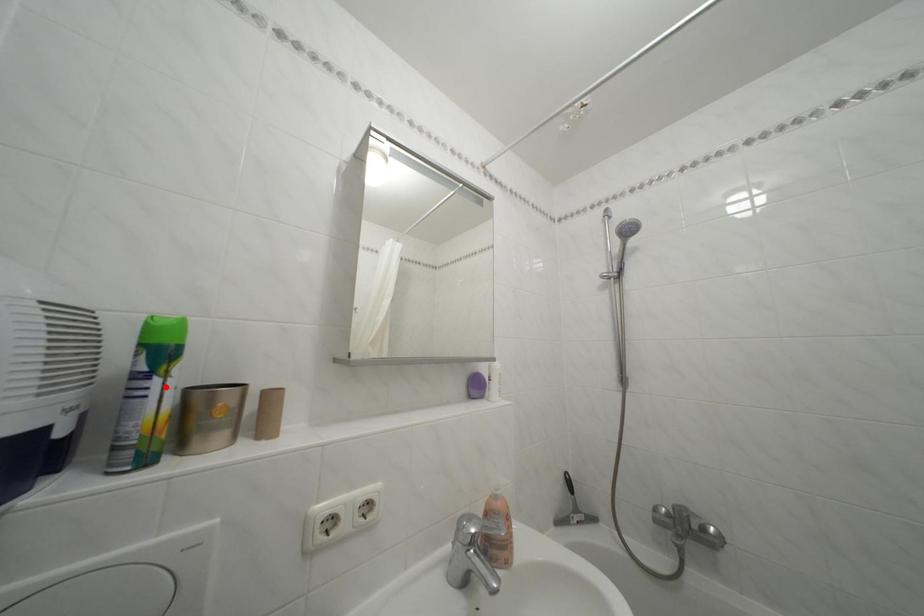
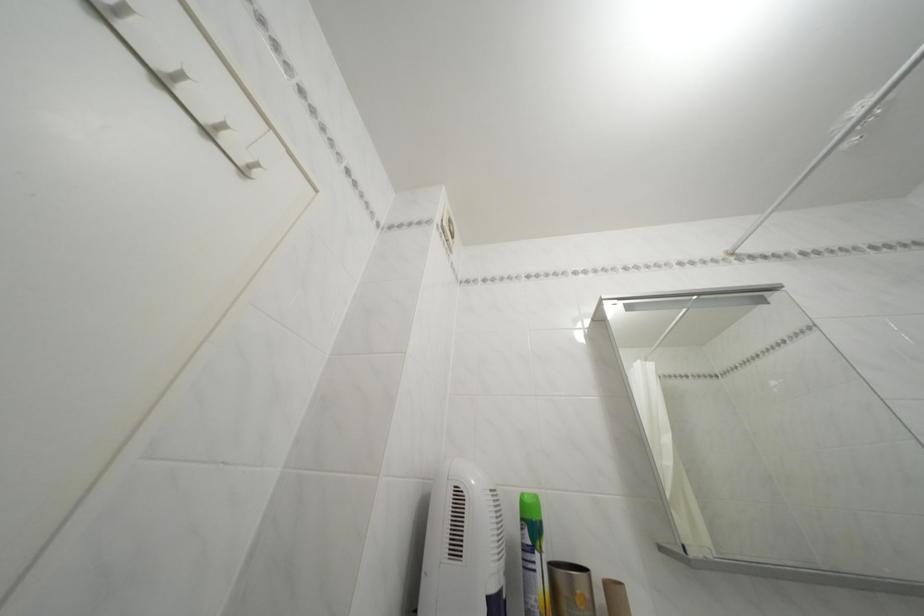
Find the pixel in the second image that matches the highlighted location in the first image.

(545, 562)